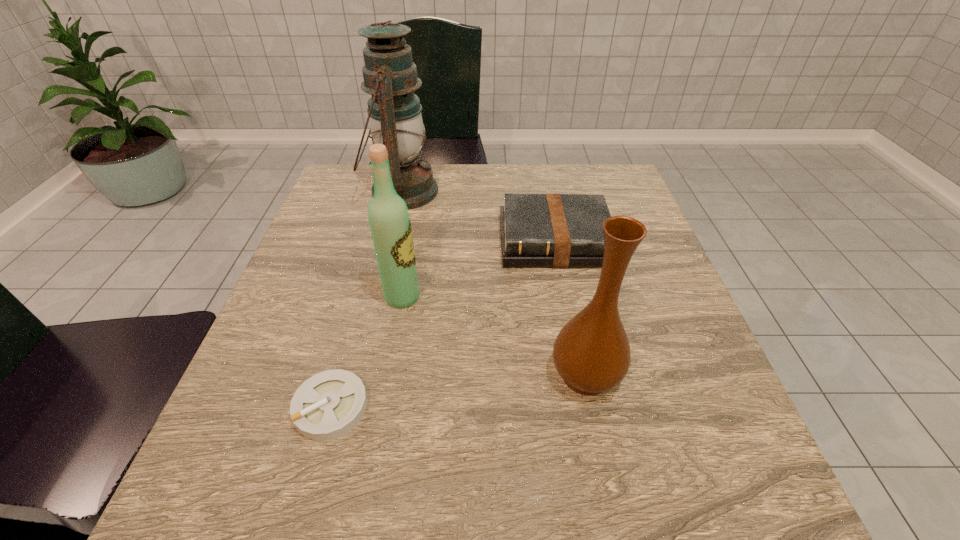
Locate an element on the screen. blank space at the far left corner is located at coordinates (343, 172).

The height and width of the screenshot is (540, 960). Identify the location of empty space that is in between the third farthest object and the hardback book. (479, 269).

Identify the location of unoccupied area between the tallest object and the hardback book. Image resolution: width=960 pixels, height=540 pixels. (478, 216).

Where is `free space between the vase and the shortest object`? free space between the vase and the shortest object is located at coordinates (458, 391).

The width and height of the screenshot is (960, 540). Find the location of `vacant area that lies between the tallest object and the vase`. vacant area that lies between the tallest object and the vase is located at coordinates (493, 284).

Locate an element on the screen. free spot between the oil lamp and the ashtray is located at coordinates (367, 299).

Find the location of a particular element. free point between the ashtray and the wine bottle is located at coordinates (367, 352).

What are the coordinates of `vacant area that lies between the ashtray and the oil lamp` in the screenshot? It's located at (367, 299).

Locate an element on the screen. This screenshot has height=540, width=960. free space between the hardback book and the shortest object is located at coordinates (443, 324).

Identify which object is the second nearest to the ashtray. Please provide its 2D coordinates. Your answer should be formatted as a tuple, i.e. [(x, y)], where the tuple contains the x and y coordinates of a point satisfying the conditions above.

[(591, 353)]